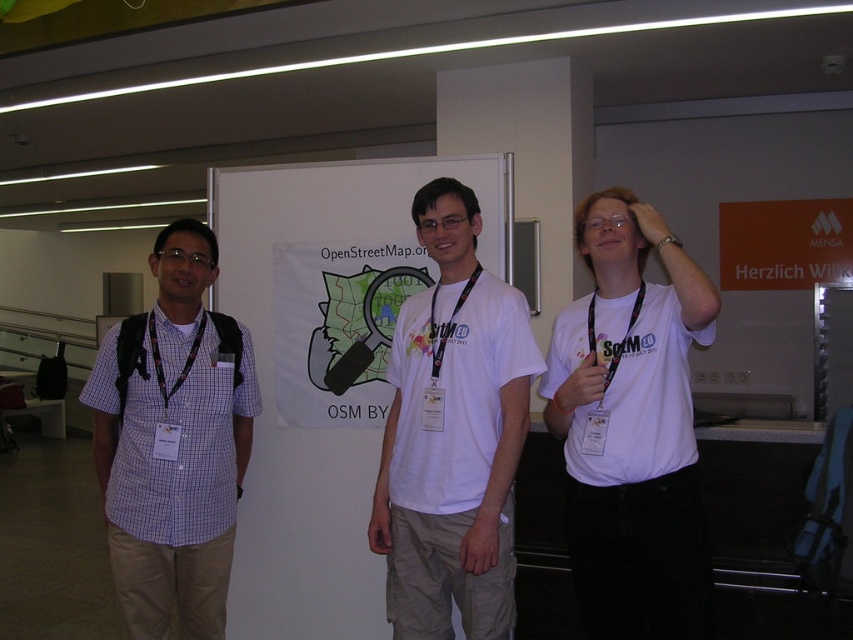
Question: In this image, where is white matte t-shirt at center located relative to white cotton t-shirt at center?

Choices:
 (A) above
 (B) below

Answer: (B)

Question: Does white cotton t-shirt at center appear on the right side of purple checkered shirt at left?

Choices:
 (A) yes
 (B) no

Answer: (A)

Question: Observing the image, what is the correct spatial positioning of white cotton t-shirt at center in reference to purple checkered shirt at left?

Choices:
 (A) above
 (B) below

Answer: (A)

Question: Which object appears closest to the camera in this image?

Choices:
 (A) white matte t-shirt at center
 (B) purple checkered shirt at left
 (C) white cotton t-shirt at center

Answer: (A)

Question: Which of these objects is positioned closest to the white cotton t-shirt at center?

Choices:
 (A) white matte t-shirt at center
 (B) purple checkered shirt at left

Answer: (A)

Question: Which object is farther from the camera taking this photo?

Choices:
 (A) white matte t-shirt at center
 (B) white cotton t-shirt at center

Answer: (B)